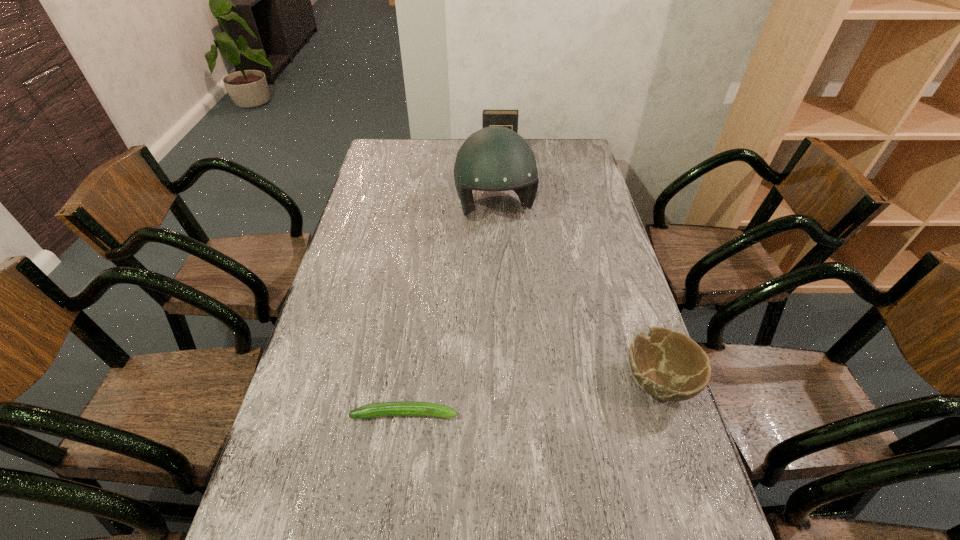
At what (x,y) coordinates should I click in order to perform the action: click on vacant area between the second farthest object and the bowl. Please return your answer as a coordinate pair (x, y). This screenshot has height=540, width=960. Looking at the image, I should click on (576, 295).

This screenshot has width=960, height=540. I want to click on free spot between the rightmost object and the diary, so click(579, 267).

Find the location of a particular element. free area in between the bowl and the football helmet is located at coordinates (576, 295).

Identify which object is the nearest to the zucchini. Please provide its 2D coordinates. Your answer should be formatted as a tuple, i.e. [(x, y)], where the tuple contains the x and y coordinates of a point satisfying the conditions above.

[(667, 364)]

Image resolution: width=960 pixels, height=540 pixels. What are the coordinates of `object that stands as the closest to the farthest object` in the screenshot? It's located at (495, 158).